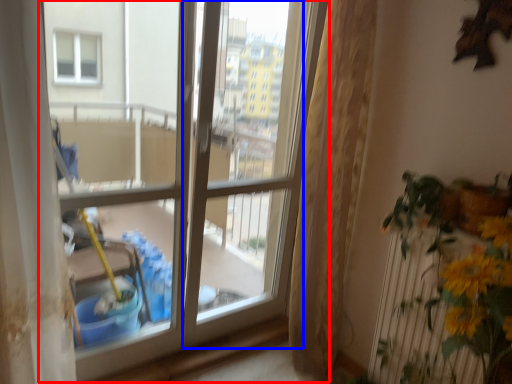
Question: Which object appears closest to the camera in this image, window (highlighted by a red box) or screen door (highlighted by a blue box)?

Choices:
 (A) window
 (B) screen door

Answer: (A)